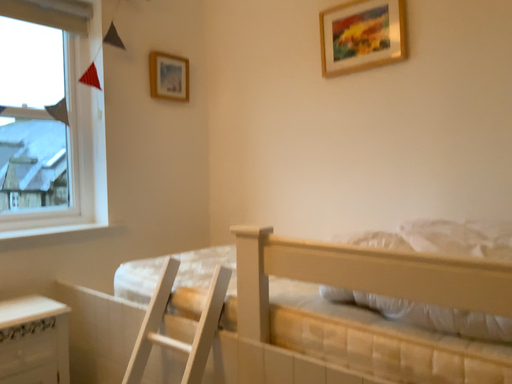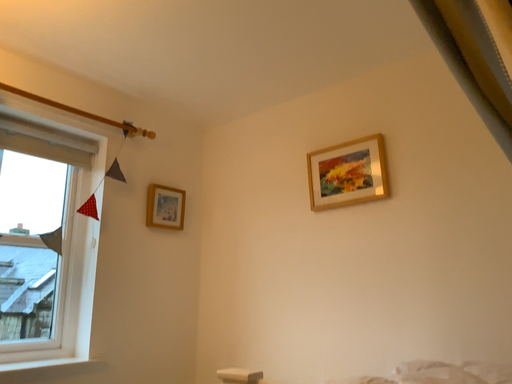
Question: Which way did the camera rotate in the video?

Choices:
 (A) rotated upward
 (B) rotated downward

Answer: (A)